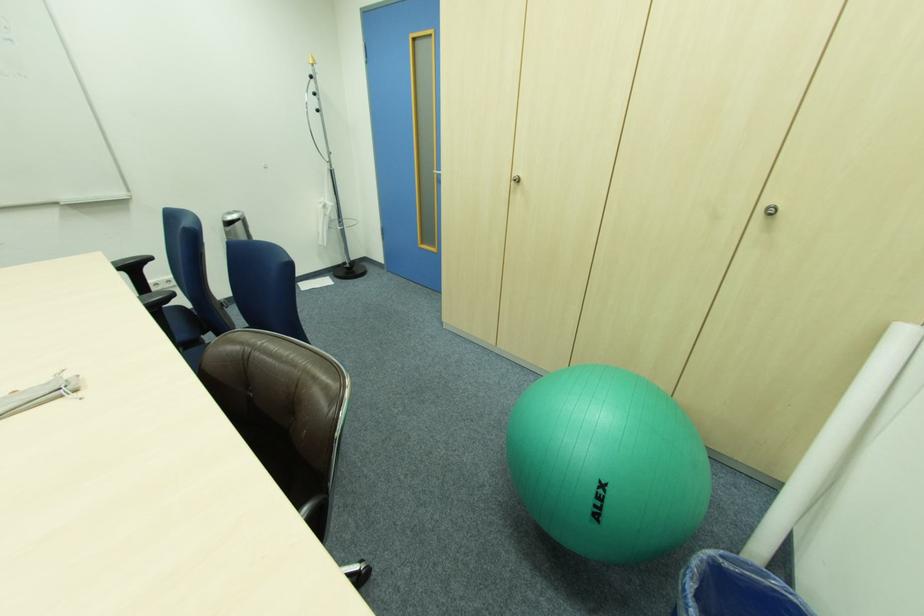
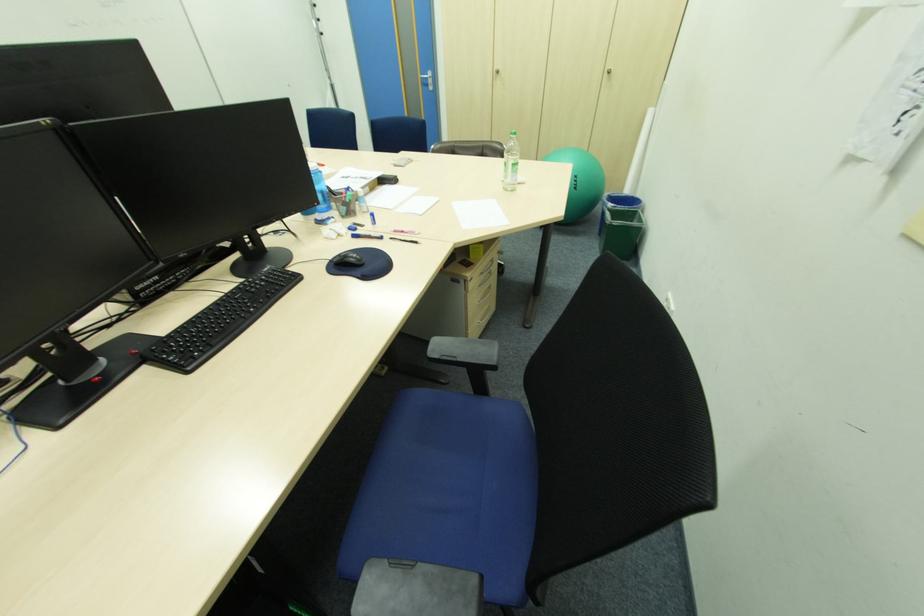
Locate, in the second image, the point that corresponds to point 442,175 in the first image.

(428, 79)